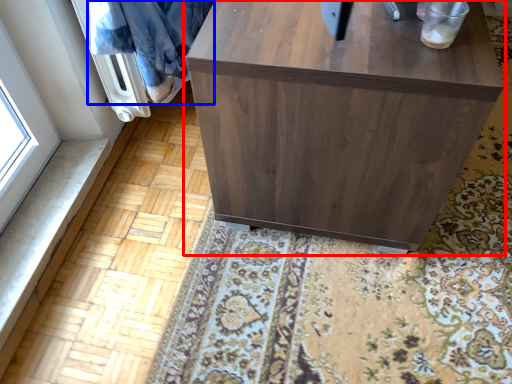
Question: Which object appears closest to the camera in this image, furniture (highlighted by a red box) or blanket (highlighted by a blue box)?

Choices:
 (A) furniture
 (B) blanket

Answer: (A)